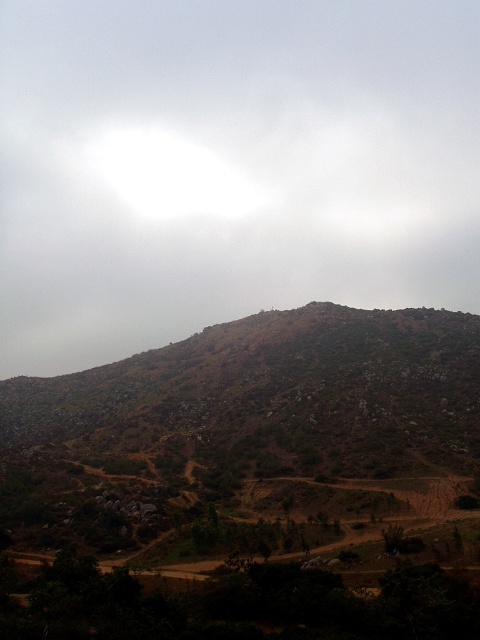
Which is in front, point (22, 195) or point (230, 328)?

Point (230, 328) is in front.

Does white fluffy cloud at upper center come behind brown rocky mountain at center?

Yes, white fluffy cloud at upper center is further from the viewer.

Which is behind, point (398, 109) or point (105, 467)?

Positioned behind is point (398, 109).

The image size is (480, 640). In order to click on white fluffy cloud at upper center in this screenshot , I will do click(228, 166).